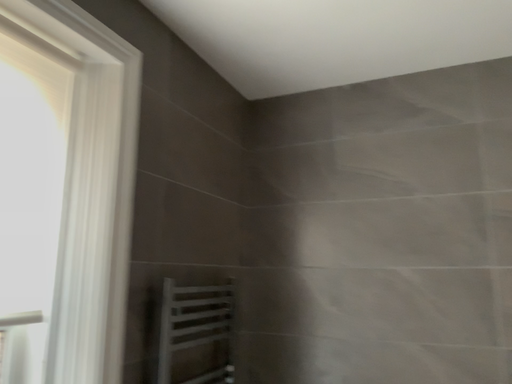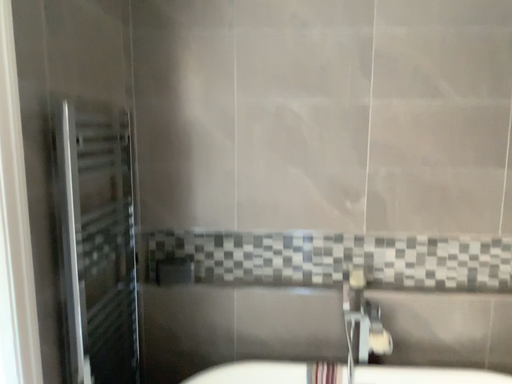
Question: How did the camera likely rotate when shooting the video?

Choices:
 (A) rotated upward
 (B) rotated downward

Answer: (B)